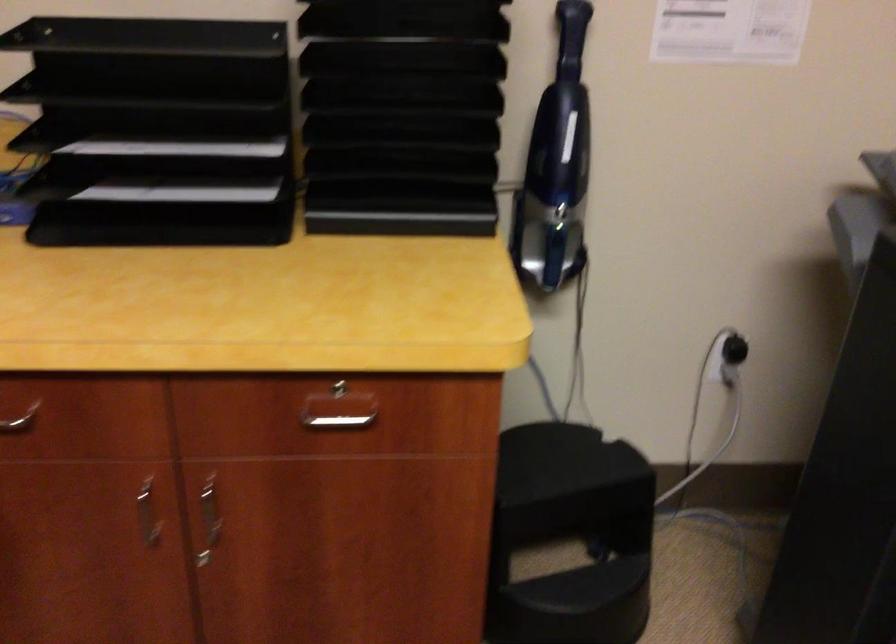
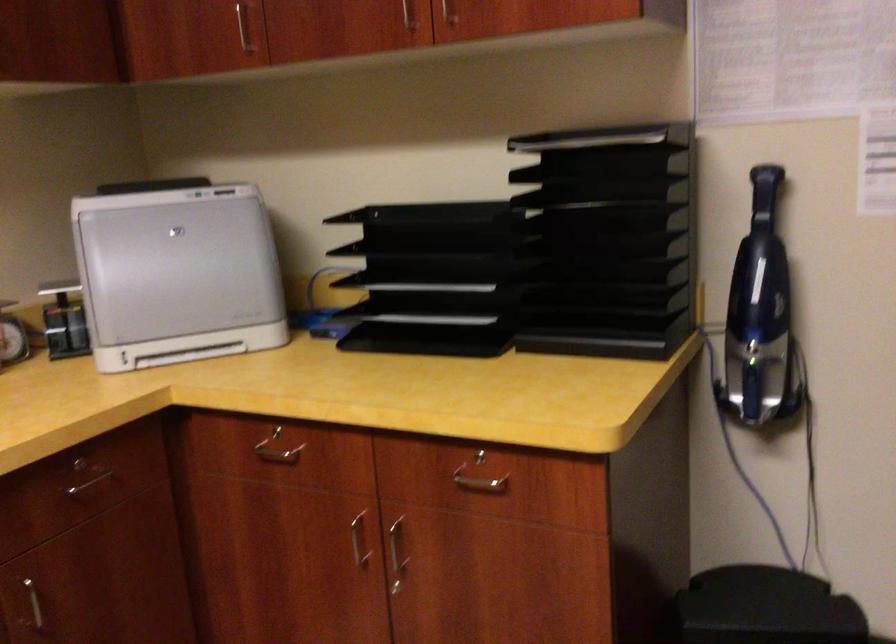
Question: The images are taken continuously from a first-person perspective. In which direction is your viewpoint rotating?

Choices:
 (A) Left
 (B) Right
 (C) Up
 (D) Down

Answer: (A)